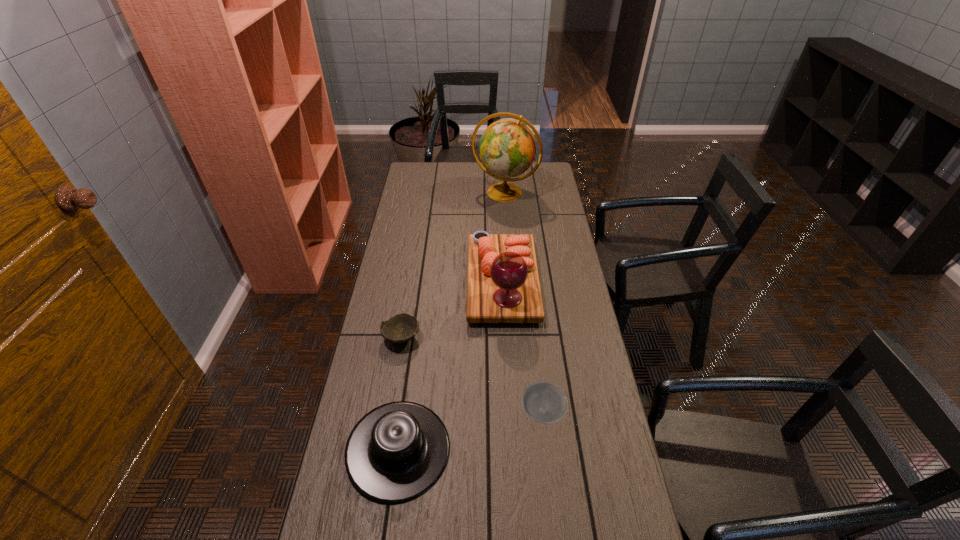
Locate an element on the screen. The width and height of the screenshot is (960, 540). free region that satisfies the following two spatial constraints: 1. on the front side of the right bowl; 2. on the left side of the farthest object is located at coordinates (521, 412).

Find the location of a particular element. free space in the image that satisfies the following two spatial constraints: 1. on the front side of the farthest object; 2. on the left side of the right bowl is located at coordinates (521, 412).